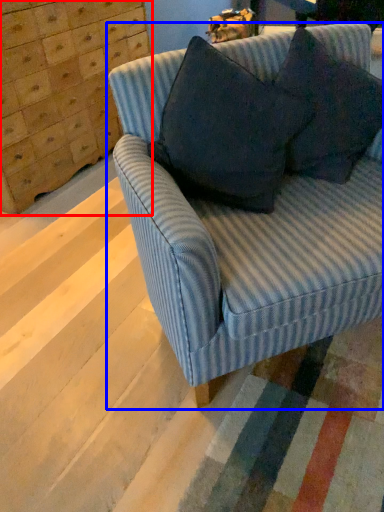
Question: Which point is closer to the camera, dresser (highlighted by a red box) or studio couch (highlighted by a blue box)?

Choices:
 (A) dresser
 (B) studio couch

Answer: (B)